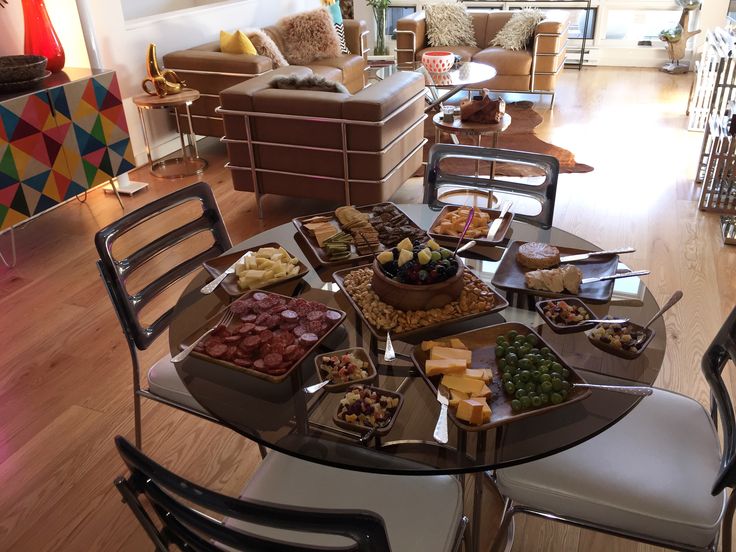
Locate an element on the screen. This screenshot has width=736, height=552. wood floor is located at coordinates (662, 210).